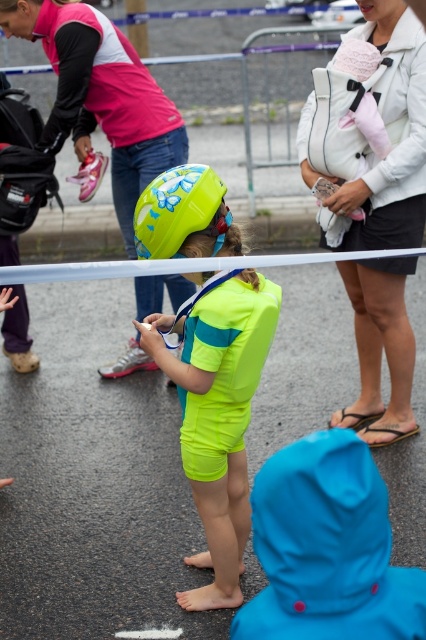
Question: Which point is closer to the camera?

Choices:
 (A) (379, 305)
 (B) (141, 84)
 (C) (201, 182)

Answer: (C)

Question: Which point appears farthest from the camera in this image?

Choices:
 (A) (155, 148)
 (B) (394, 364)
 (C) (204, 387)

Answer: (A)

Question: Is neon yellow swimsuit at center wider than pink fabric jacket at upper left?

Choices:
 (A) yes
 (B) no

Answer: (B)

Question: Can you confirm if neon yellow swimsuit at center is wider than light gray fabric baby carrier at upper right?

Choices:
 (A) yes
 (B) no

Answer: (B)

Question: Can you confirm if light gray fabric baby carrier at upper right is positioned below pink fabric jacket at upper left?

Choices:
 (A) no
 (B) yes

Answer: (B)

Question: Which point appears farthest from the camera in this image?

Choices:
 (A) (339, 202)
 (B) (80, 86)

Answer: (B)